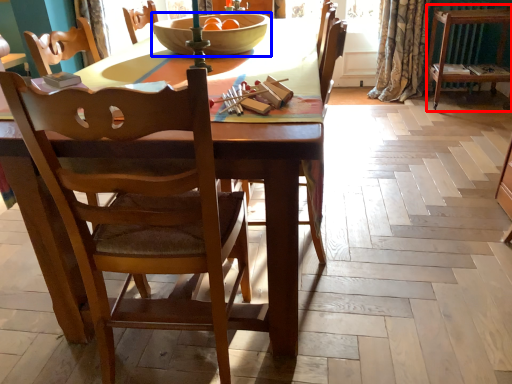
Question: Which object appears closest to the camera in this image, dresser (highlighted by a red box) or bowl (highlighted by a blue box)?

Choices:
 (A) dresser
 (B) bowl

Answer: (B)